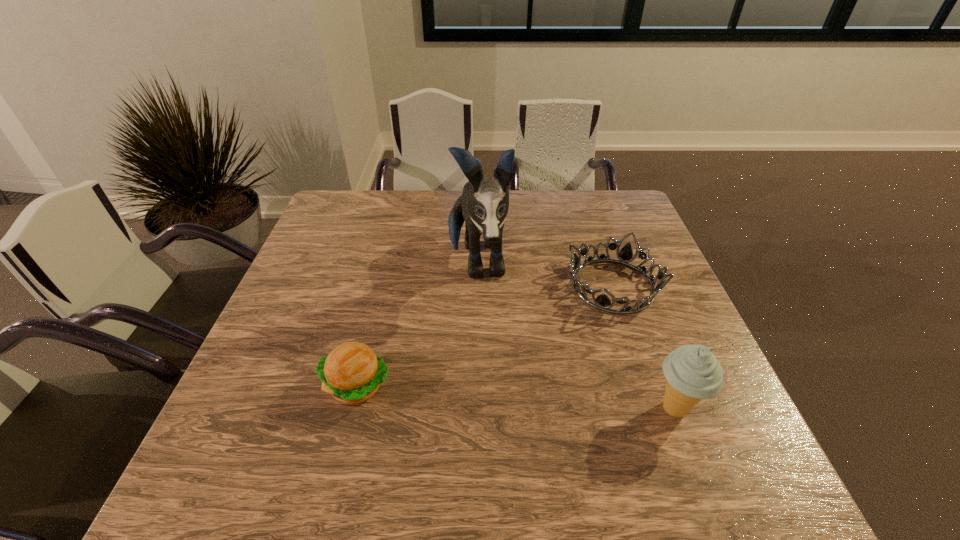
Identify the location of vacant point located between the shortest object and the puppy. (544, 274).

Where is `vacant space in between the leftmost object and the tiara`? The image size is (960, 540). vacant space in between the leftmost object and the tiara is located at coordinates (485, 335).

The image size is (960, 540). In order to click on free spot between the tiara and the third tallest object in this screenshot , I will do `click(485, 335)`.

Identify the location of free space between the third tallest object and the icecream. This screenshot has width=960, height=540. pos(516,397).

This screenshot has height=540, width=960. Identify the location of empty location between the tallest object and the second tallest object. (576, 336).

At what (x,y) coordinates should I click in order to perform the action: click on vacant point located between the shortest object and the puppy. Please return your answer as a coordinate pair (x, y). The width and height of the screenshot is (960, 540). Looking at the image, I should click on (544, 274).

Choose which object is the second nearest neighbor to the puppy. Please provide its 2D coordinates. Your answer should be formatted as a tuple, i.e. [(x, y)], where the tuple contains the x and y coordinates of a point satisfying the conditions above.

[(352, 372)]

Choose which object is the nearest neighbor to the leftmost object. Please provide its 2D coordinates. Your answer should be formatted as a tuple, i.e. [(x, y)], where the tuple contains the x and y coordinates of a point satisfying the conditions above.

[(484, 203)]

Where is `vacant region that satisfies the following two spatial constraints: 1. on the front side of the third object from right to left; 2. on the right side of the shortest object`? vacant region that satisfies the following two spatial constraints: 1. on the front side of the third object from right to left; 2. on the right side of the shortest object is located at coordinates (476, 286).

Identify the location of vacant space that satisfies the following two spatial constraints: 1. on the front side of the icecream; 2. on the right side of the third object from right to left. The width and height of the screenshot is (960, 540). (475, 409).